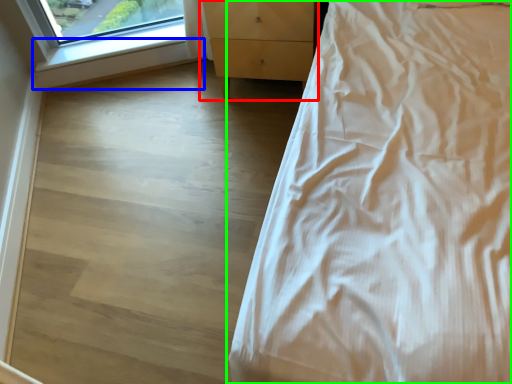
Question: Estimate the real-world distances between objects in this image. Which object is farther from chest of drawers (highlighted by a red box), window sill (highlighted by a blue box) or bed (highlighted by a green box)?

Choices:
 (A) window sill
 (B) bed

Answer: (B)